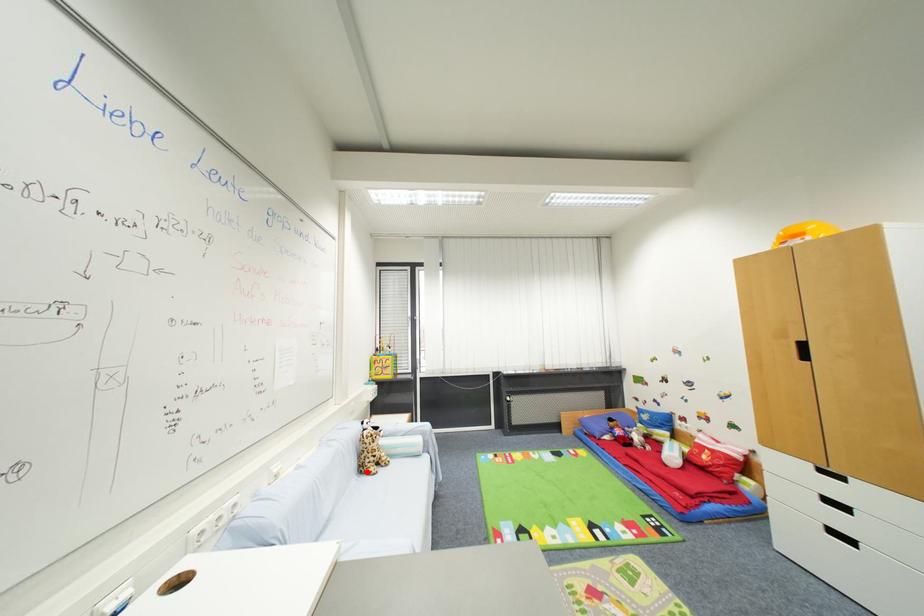
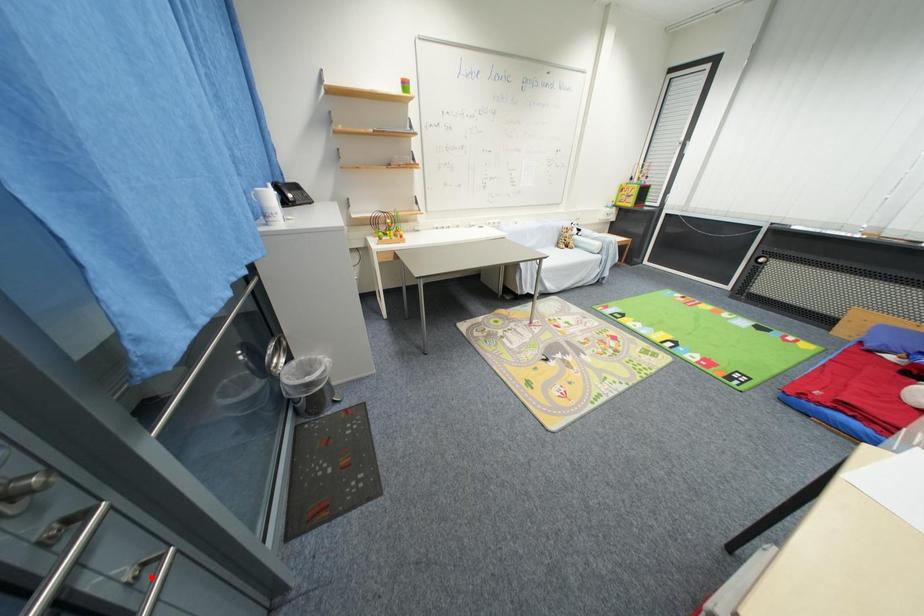
I am providing you with two images of the same scene from different viewpoints. A red point is marked on the first image and another point is marked on the second image. Does the point marked in image1 correspond to the same location as the one in image2?

No